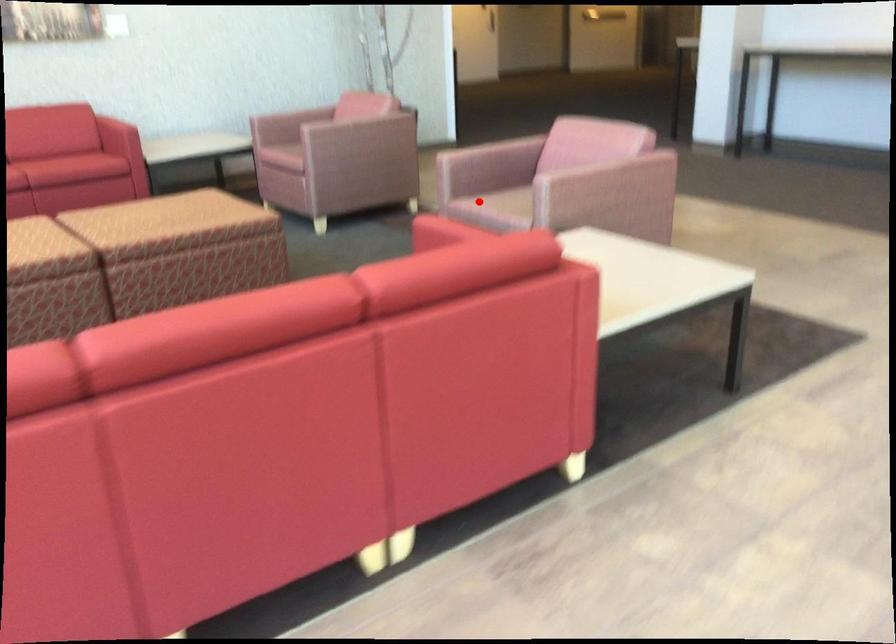
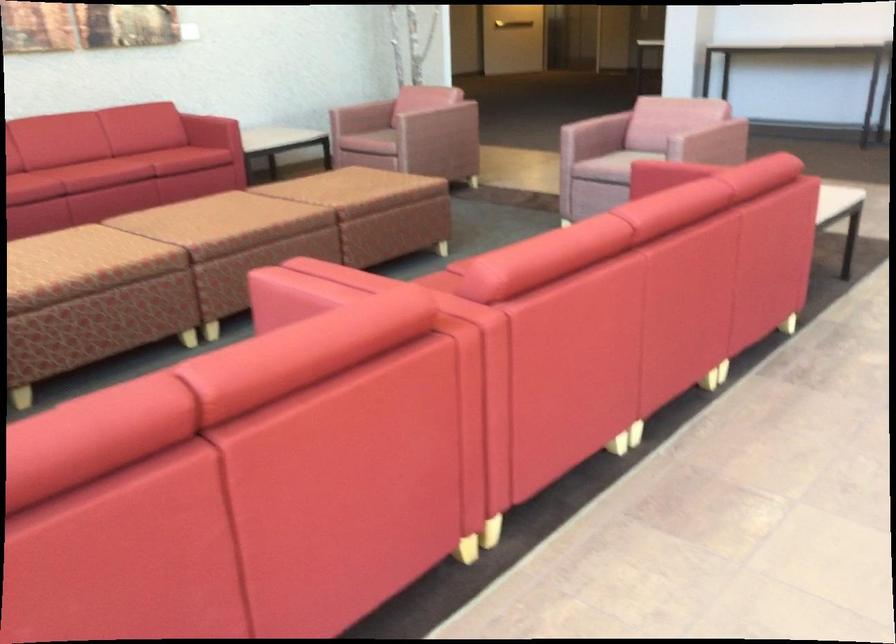
Locate, in the second image, the point that corresponds to the highlighted location in the first image.

(615, 166)